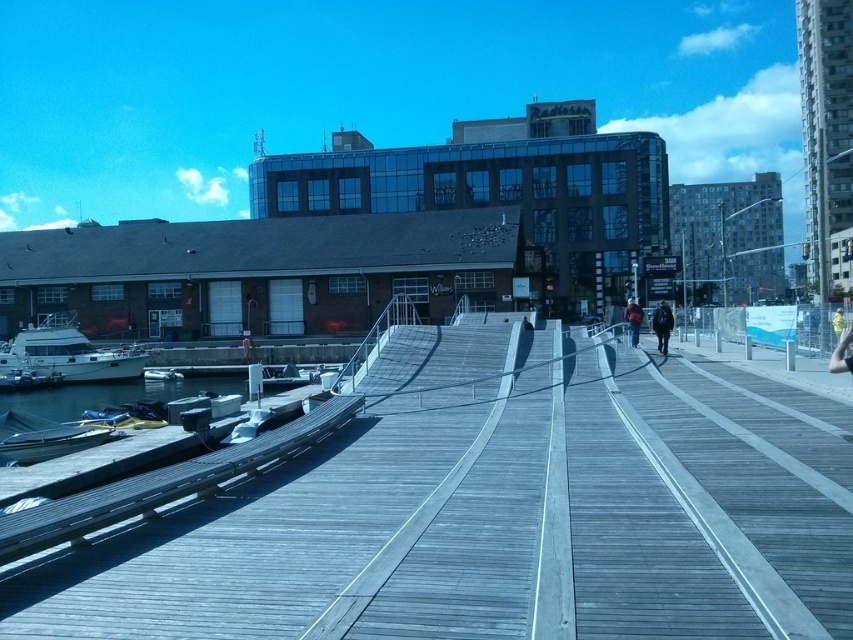
Does dark blue jacket at center appear on the right side of yellow reflective vest at center?

Indeed, dark blue jacket at center is positioned on the right side of yellow reflective vest at center.

From the picture: Is the position of dark blue jacket at center less distant than that of yellow reflective vest at center?

No.

Locate an element on the screen. The height and width of the screenshot is (640, 853). dark blue jacket at center is located at coordinates (633, 320).

Does black leather jacket at center have a greater width compared to dark blue jacket at center?

Incorrect, black leather jacket at center's width does not surpass dark blue jacket at center's.

Where is `black leather jacket at center`? The image size is (853, 640). black leather jacket at center is located at coordinates (662, 324).

Find the location of a particular element. The width and height of the screenshot is (853, 640). black leather jacket at center is located at coordinates (662, 324).

From the picture: Between wooden planks at center and dark blue jacket at center, which one appears on the right side from the viewer's perspective?

Positioned to the right is dark blue jacket at center.

Can you confirm if wooden planks at center is positioned to the right of dark blue jacket at center?

Incorrect, wooden planks at center is not on the right side of dark blue jacket at center.

The image size is (853, 640). What do you see at coordinates (495, 513) in the screenshot?
I see `wooden planks at center` at bounding box center [495, 513].

Identify the location of wooden planks at center. (495, 513).